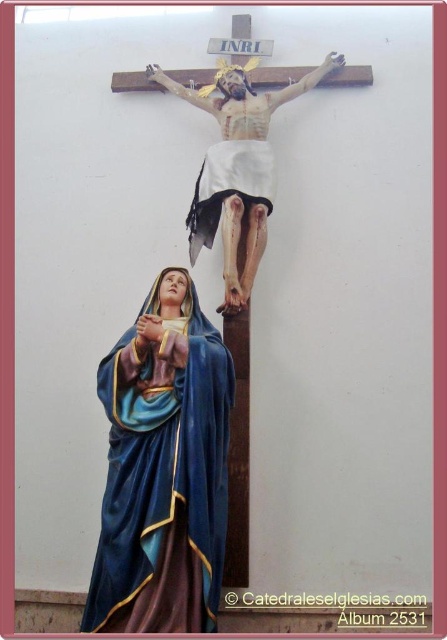
Is matte blue fabric statue at lower left shorter than wooden crucifix at upper center?

Yes, matte blue fabric statue at lower left is shorter than wooden crucifix at upper center.

Measure the distance between point (136, 380) and camera.

Point (136, 380) is 51.26 meters away from camera.

Locate an element on the screen. This screenshot has height=640, width=447. matte blue fabric statue at lower left is located at coordinates tap(163, 468).